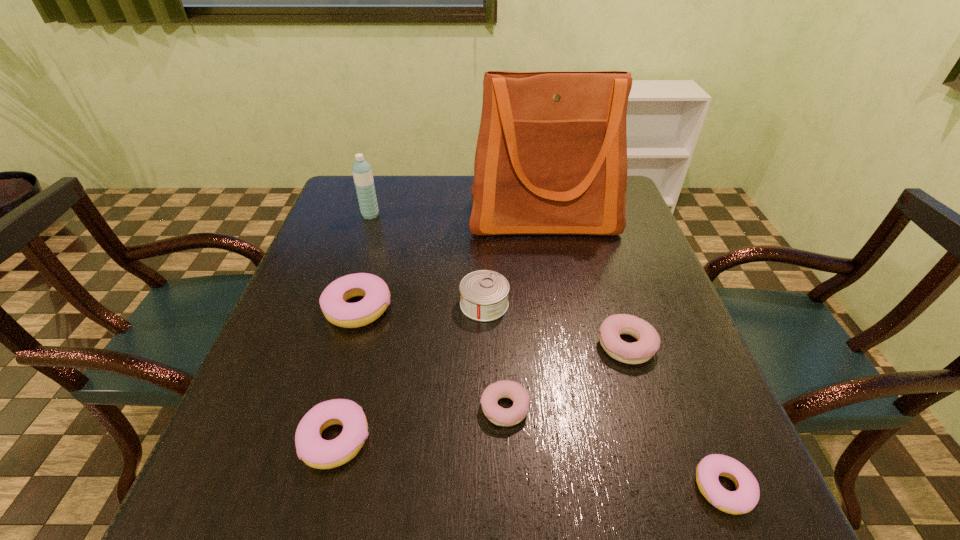
The height and width of the screenshot is (540, 960). What are the coordinates of `brown shopping bag` in the screenshot? It's located at (551, 157).

The image size is (960, 540). Identify the location of the tallest object. click(551, 157).

What are the coordinates of `water bottle` in the screenshot? It's located at (362, 172).

The height and width of the screenshot is (540, 960). In order to click on blue water bottle in this screenshot , I will do `click(362, 172)`.

Locate an element on the screen. can is located at coordinates (484, 293).

The width and height of the screenshot is (960, 540). In order to click on the farthest pink doughnut in this screenshot , I will do `click(375, 291)`.

This screenshot has width=960, height=540. I want to click on the bigger purple doughnut, so coord(648,342).

The height and width of the screenshot is (540, 960). In order to click on the right purple doughnut in this screenshot , I will do `click(648, 342)`.

Image resolution: width=960 pixels, height=540 pixels. In order to click on the second smallest pink doughnut in this screenshot , I will do `click(312, 449)`.

You are a GUI agent. You are given a task and a screenshot of the screen. Output one action in this format:
    pyautogui.click(x=<x>, y=<y>)
    Task: Click on the left purple doughnut
    
    Given the screenshot: What is the action you would take?
    pyautogui.click(x=498, y=415)